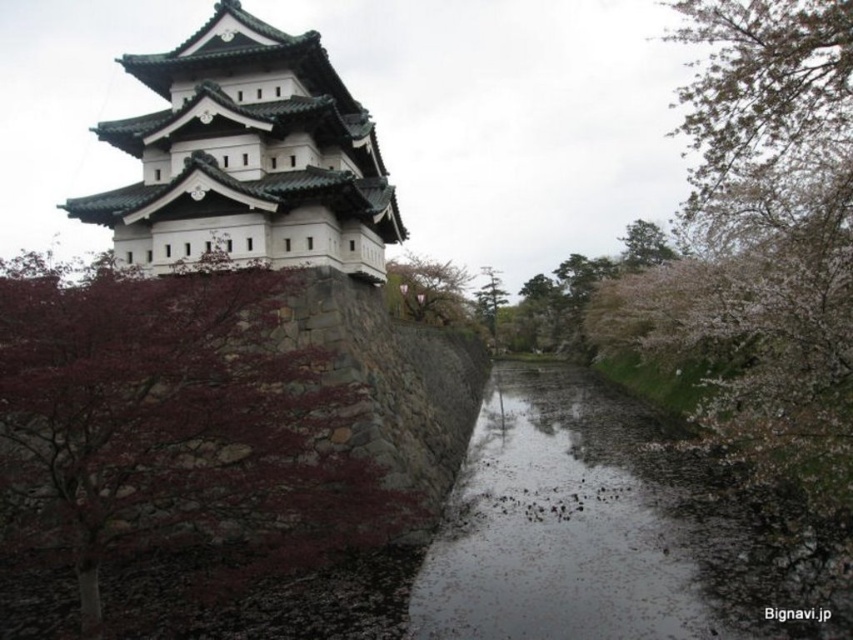
You are a visitor at Hirosaki Castle and notice two landmarks in the scene. Which object takes up more area in the image? Please choose between the dark red bark tree at left and the white stone tower at upper left.

The white stone tower at upper left occupies more space in the image than the dark red bark tree at left.

You are standing in front of the Hirosaki Castle and notice two trees in the scene. The dark red bark tree at left and the green leafy tree at upper center. Which tree is positioned more to the left side of the image?

The dark red bark tree at left is positioned more to the left side of the image compared to the green leafy tree at upper center.